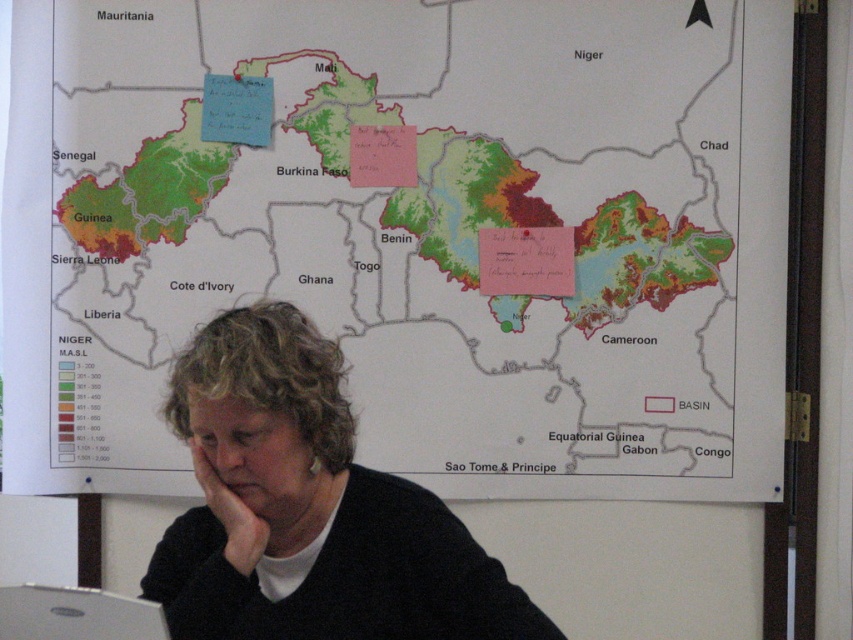
Consider the image. Is black sweater at lower center below silver metallic laptop at lower left?

No.

Does point (329, 536) come farther from viewer compared to point (103, 620)?

Yes, point (329, 536) is behind point (103, 620).

Between point (178, 356) and point (152, 625), which one is positioned in front?

Positioned in front is point (152, 625).

Where is `black sweater at lower center`? The height and width of the screenshot is (640, 853). black sweater at lower center is located at coordinates (308, 508).